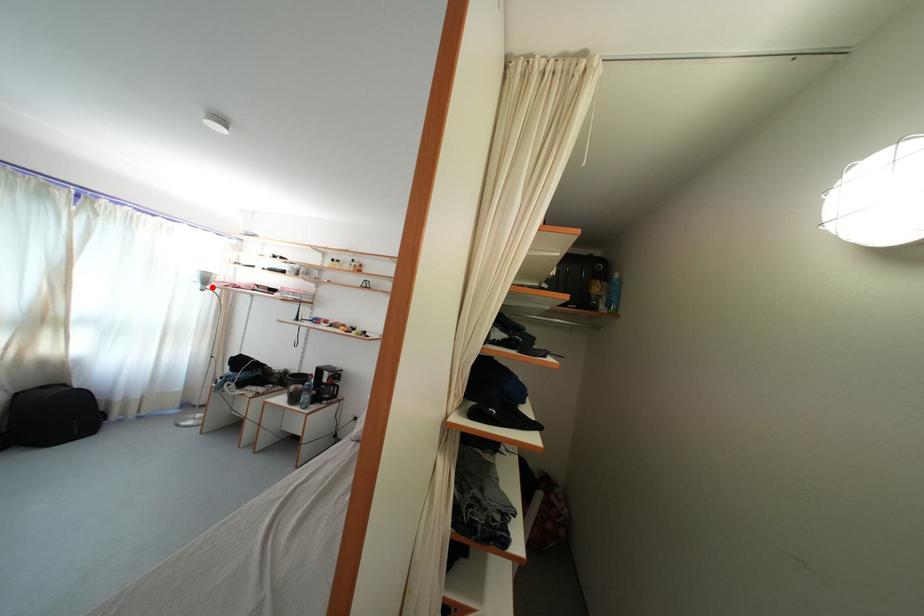
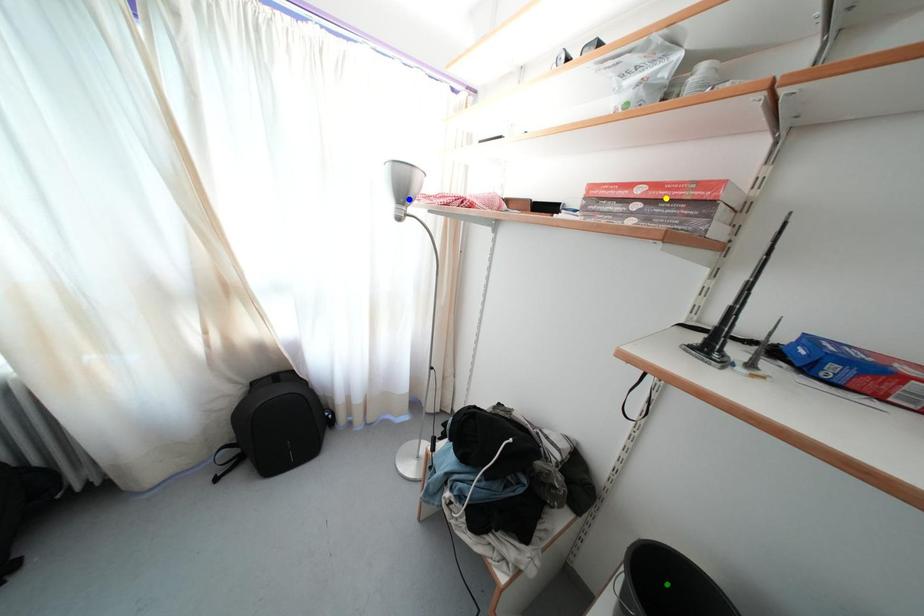
Question: I am providing you with two images of the same scene from different viewpoints. A red point is marked on the first image. You are given multiple points on the second image. Which mark in image 2 goes with the point in image 1?

Choices:
 (A) blue point
 (B) yellow point
 (C) green point

Answer: (A)